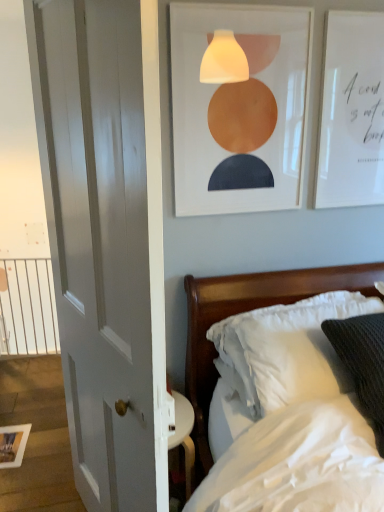
Question: Considering the relative sizes of wooden bed at right and white smooth door at left in the image provided, is wooden bed at right shorter than white smooth door at left?

Choices:
 (A) yes
 (B) no

Answer: (A)

Question: Does wooden bed at right turn towards white smooth door at left?

Choices:
 (A) yes
 (B) no

Answer: (B)

Question: Is wooden bed at right outside of white smooth door at left?

Choices:
 (A) no
 (B) yes

Answer: (B)

Question: Is wooden bed at right far away from white smooth door at left?

Choices:
 (A) no
 (B) yes

Answer: (A)

Question: Is white smooth door at left located within wooden bed at right?

Choices:
 (A) yes
 (B) no

Answer: (B)

Question: From a real-world perspective, is white soft pillow at lower right physically located above or below white paper at upper right, which appears as the 3th picture frame when ordered from the bottom?

Choices:
 (A) below
 (B) above

Answer: (A)

Question: Relative to white paper at upper right, the 2th picture frame positioned from the front, is white soft pillow at lower right in front or behind?

Choices:
 (A) behind
 (B) front

Answer: (B)

Question: Is white soft pillow at lower right taller or shorter than white paper at upper right, arranged as the 3th picture frame when viewed from the left?

Choices:
 (A) short
 (B) tall

Answer: (A)

Question: Is white soft pillow at lower right inside the boundaries of white paper at upper right, the second picture frame viewed from the back, or outside?

Choices:
 (A) inside
 (B) outside

Answer: (B)

Question: From the image's perspective, is white matte picture frame at upper center, positioned as the 2th picture frame in right-to-left order, positioned above or below white soft pillow at lower right?

Choices:
 (A) above
 (B) below

Answer: (A)

Question: Do you think white matte picture frame at upper center, positioned as the 2th picture frame in right-to-left order, is within white soft pillow at lower right, or outside of it?

Choices:
 (A) inside
 (B) outside

Answer: (B)

Question: In terms of width, does white matte picture frame at upper center, which is the third picture frame from back to front, look wider or thinner when compared to white soft pillow at lower right?

Choices:
 (A) wide
 (B) thin

Answer: (B)

Question: Would you say white matte picture frame at upper center, the first picture frame from the front, is to the left or to the right of white soft pillow at lower right in the picture?

Choices:
 (A) right
 (B) left

Answer: (B)

Question: From a real-world perspective, is white metal balustrade at left above or below wooden picture frame at lower left, which ranks as the third picture frame in top-to-bottom order?

Choices:
 (A) above
 (B) below

Answer: (A)

Question: Considering the positions of white metal balustrade at left and wooden picture frame at lower left, which ranks as the first picture frame in bottom-to-top order, in the image, is white metal balustrade at left taller or shorter than wooden picture frame at lower left, which ranks as the first picture frame in bottom-to-top order,?

Choices:
 (A) tall
 (B) short

Answer: (A)